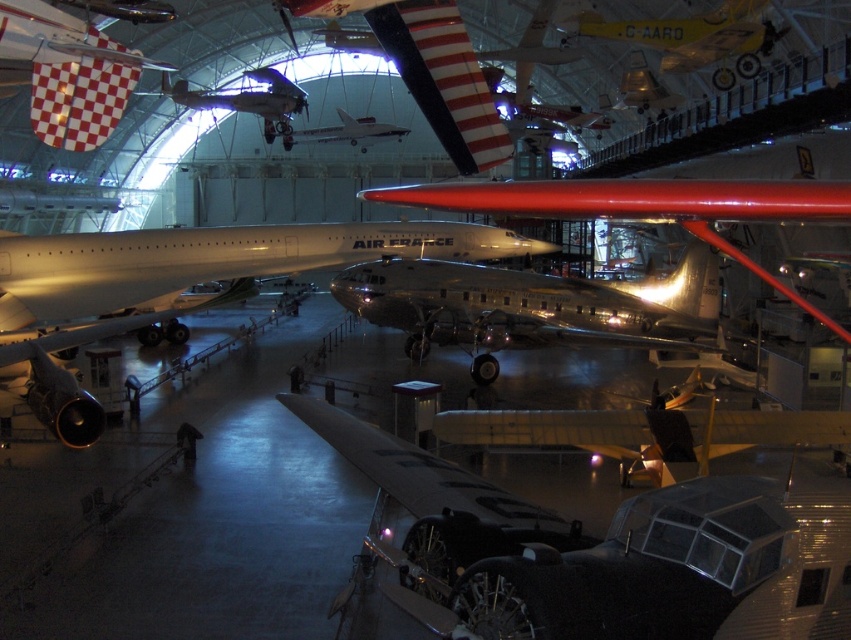
Question: Is shiny silver airplane at lower right bigger than yellow polished wood airplane at upper center?

Choices:
 (A) no
 (B) yes

Answer: (B)

Question: Does shiny silver airplane at lower right come in front of polished silver airplane at center?

Choices:
 (A) yes
 (B) no

Answer: (A)

Question: Does shiny silver airplane at upper center appear over metallic silver airplane at center?

Choices:
 (A) no
 (B) yes

Answer: (B)

Question: Which of the following is the closest to the observer?

Choices:
 (A) metallic silver airplane at center
 (B) shiny silver airplane at upper center
 (C) shiny silver airplane at lower right
 (D) yellow polished wood airplane at upper center

Answer: (C)

Question: Which of the following is the closest to the observer?

Choices:
 (A) (717, 45)
 (B) (377, 122)
 (C) (752, 540)
 (D) (574, 340)

Answer: (C)

Question: Estimate the real-world distances between objects in this image. Which object is farther from the shiny silver airplane at lower right?

Choices:
 (A) shiny silver airplane at upper center
 (B) metallic silver airplane at center
 (C) yellow polished wood airplane at upper center
 (D) polished silver airplane at center

Answer: (B)